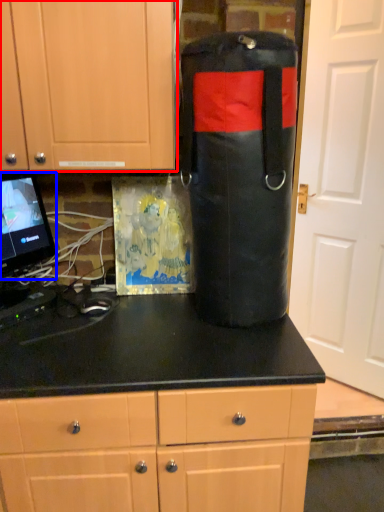
Question: Among these objects, which one is farthest to the camera, cabinetry (highlighted by a red box) or computer monitor (highlighted by a blue box)?

Choices:
 (A) cabinetry
 (B) computer monitor

Answer: (B)